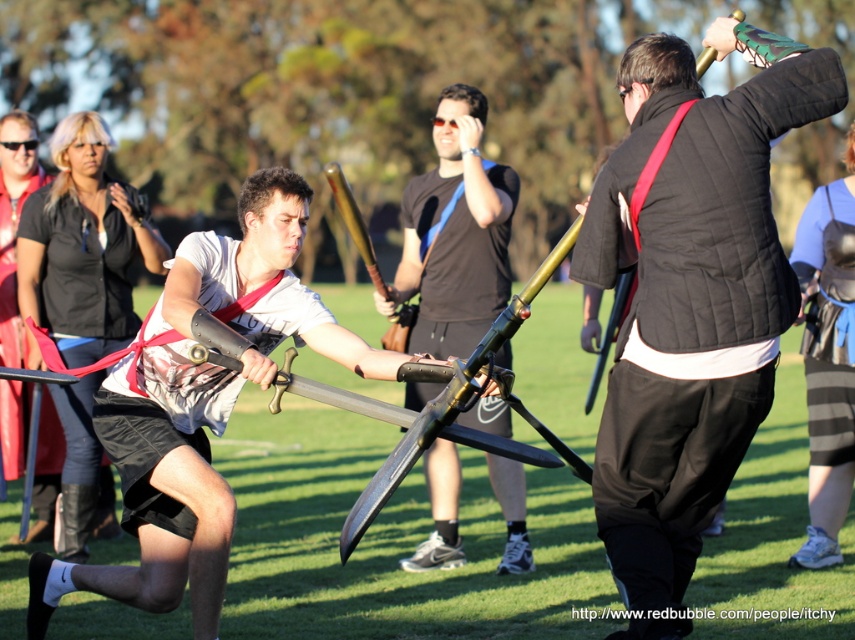
Question: Does matte silver sword at center lie behind matte black shirt at left?

Choices:
 (A) yes
 (B) no

Answer: (B)

Question: Which of the following is the farthest from the observer?

Choices:
 (A) (99, 444)
 (B) (828, 291)

Answer: (B)

Question: Is matte black sword at center closer to camera compared to matte black shirt at left?

Choices:
 (A) yes
 (B) no

Answer: (A)

Question: Observing the image, what is the correct spatial positioning of matte white shirt at left in reference to matte black shirt at left?

Choices:
 (A) below
 (B) above

Answer: (A)

Question: Considering the real-world distances, which object is closest to the matte black padded armor at center?

Choices:
 (A) black leather armor at lower right
 (B) matte white shirt at left
 (C) matte silver sword at center
 (D) matte black sword at center

Answer: (C)

Question: Which object is positioned farthest from the matte black padded armor at center?

Choices:
 (A) matte white shirt at left
 (B) matte black shirt at left
 (C) matte silver sword at center
 (D) black leather armor at lower right

Answer: (B)